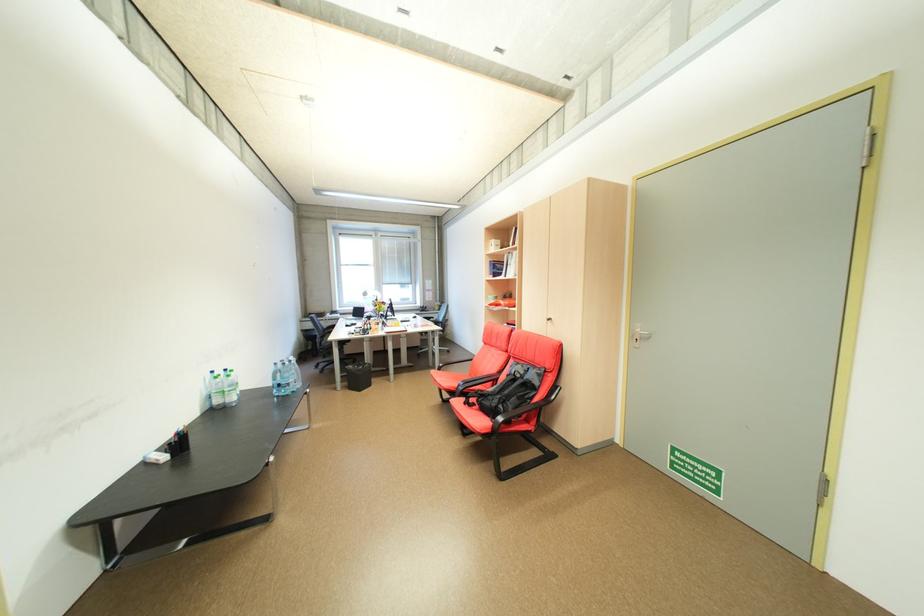
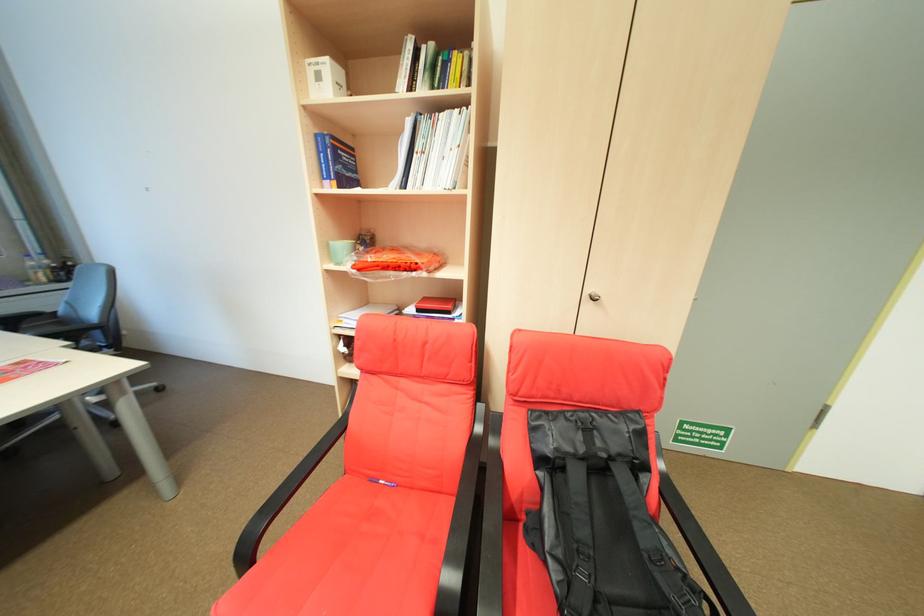
In the second image, find the point that corresponds to the point at 503,265 in the first image.

(344, 148)